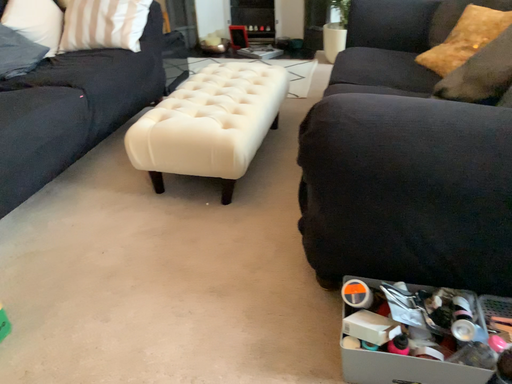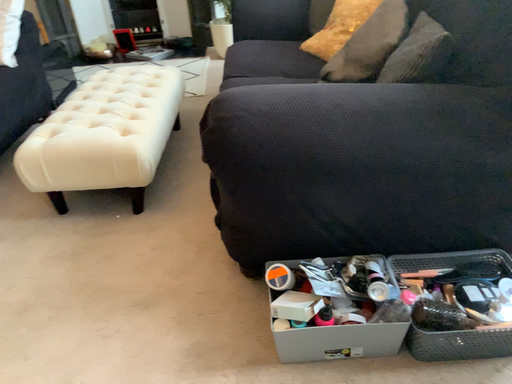
Question: Which way did the camera rotate in the video?

Choices:
 (A) rotated left
 (B) rotated right

Answer: (B)